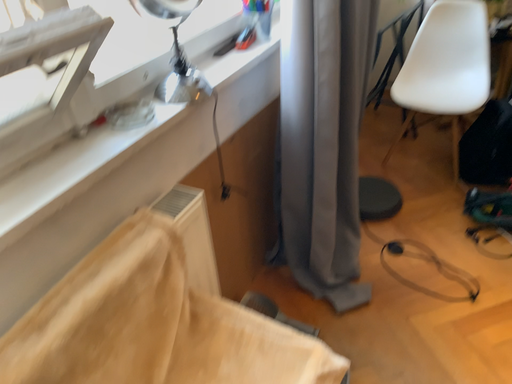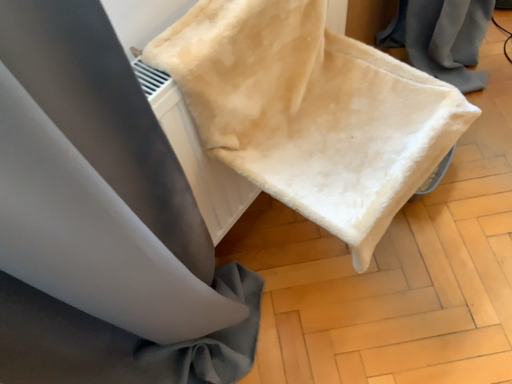
Question: Which way did the camera rotate in the video?

Choices:
 (A) rotated upward
 (B) rotated downward

Answer: (B)